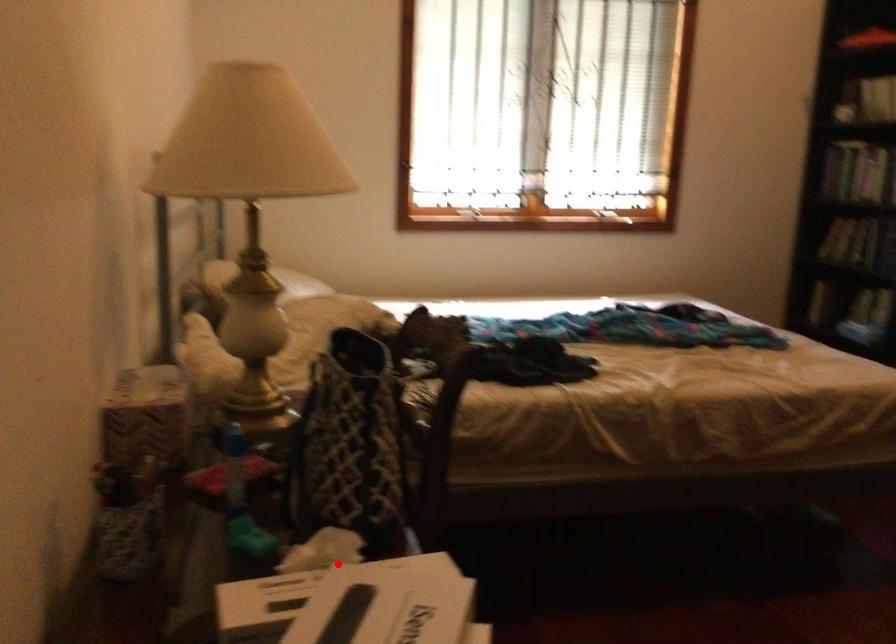
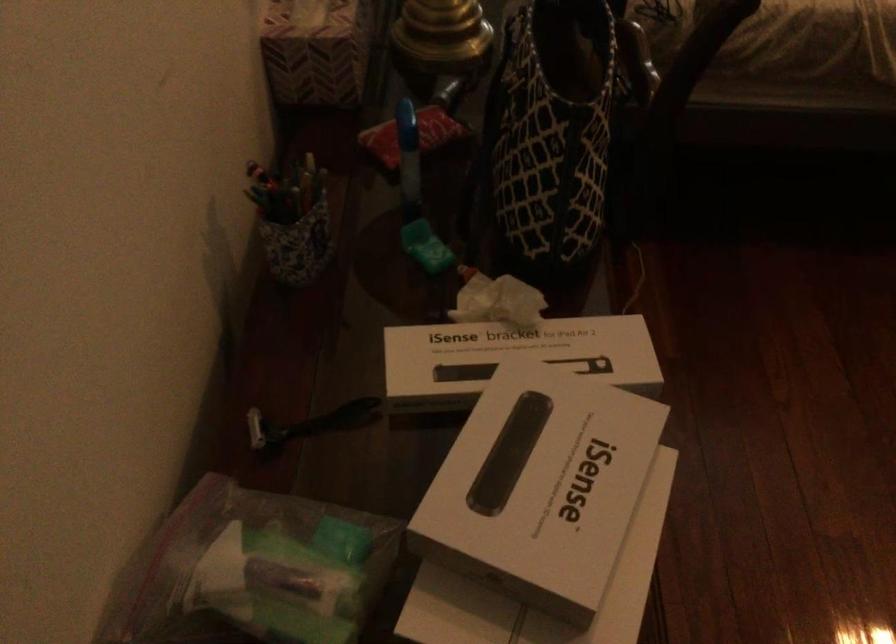
In the second image, find the point that corresponds to the highlighted location in the first image.

(515, 353)